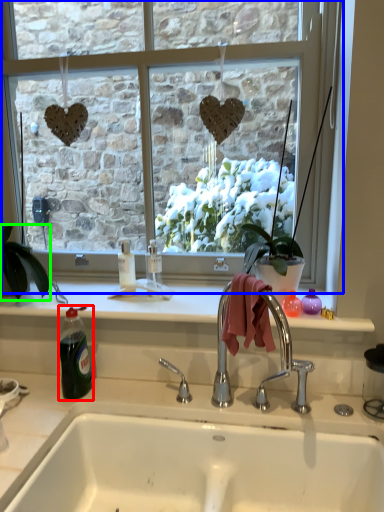
Question: Based on their relative distances, which object is nearer to bottle (highlighted by a red box)? Choose from window (highlighted by a blue box) and houseplant (highlighted by a green box).

Choices:
 (A) window
 (B) houseplant

Answer: (B)